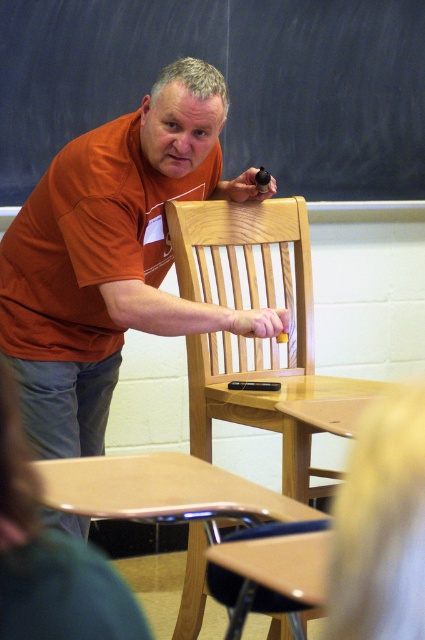
Is matte orange shirt at center to the right of blue fabric shirt at lower left from the viewer's perspective?

No, matte orange shirt at center is not to the right of blue fabric shirt at lower left.

Image resolution: width=425 pixels, height=640 pixels. Describe the element at coordinates (113, 257) in the screenshot. I see `matte orange shirt at center` at that location.

Locate an element on the screen. matte orange shirt at center is located at coordinates [x=113, y=257].

Does matte orange shirt at center have a lesser width compared to wooden chair at center?

No.

Who is lower down, matte orange shirt at center or wooden chair at center?

Positioned lower is wooden chair at center.

Does point (93, 152) come closer to viewer compared to point (277, 378)?

Yes, it is.

The image size is (425, 640). In order to click on matte orange shirt at center in this screenshot , I will do `click(113, 257)`.

Is point (260, 92) closer to camera compared to point (297, 310)?

No.

This screenshot has height=640, width=425. In order to click on black chalkboard at upper center in this screenshot , I will do `click(227, 84)`.